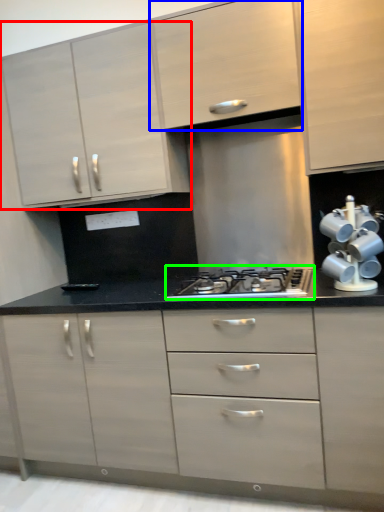
Question: Based on their relative distances, which object is farther from cabinetry (highlighted by a red box)? Choose from cabinetry (highlighted by a blue box) and gas stove (highlighted by a green box).

Choices:
 (A) cabinetry
 (B) gas stove

Answer: (B)